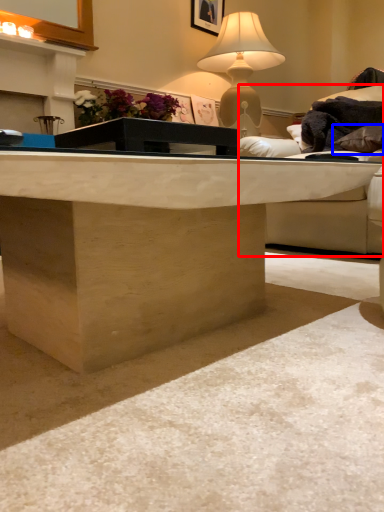
Question: Which object appears farthest to the camera in this image, studio couch (highlighted by a red box) or pillow (highlighted by a blue box)?

Choices:
 (A) studio couch
 (B) pillow

Answer: (B)